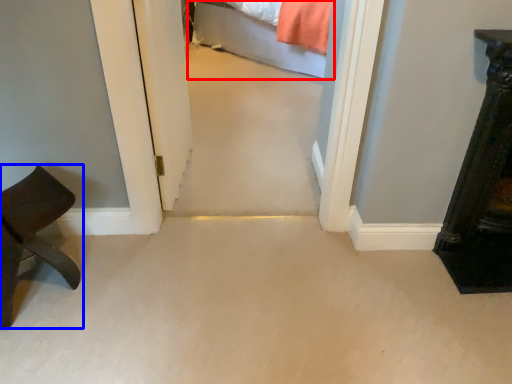
Question: Which of the following is the farthest to the observer, bed (highlighted by a red box) or furniture (highlighted by a blue box)?

Choices:
 (A) bed
 (B) furniture

Answer: (A)